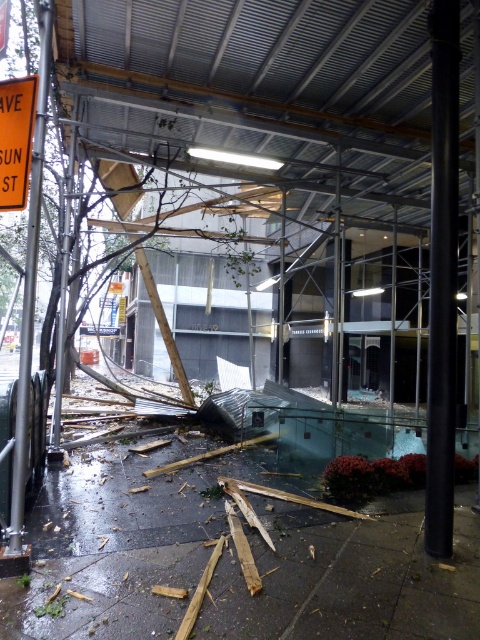
Between point (50, 616) and point (15, 515), which one is positioned behind?

The point (15, 515) is more distant.

Does wet concrete pavement at lower center appear under green metallic pole at left?

Indeed, wet concrete pavement at lower center is positioned under green metallic pole at left.

This screenshot has height=640, width=480. Find the location of `wet concrete pavement at lower center`. wet concrete pavement at lower center is located at coordinates (121, 540).

Does wet concrete pavement at lower center have a smaller size compared to orange reflective plastic sign at upper left?

Incorrect, wet concrete pavement at lower center is not smaller in size than orange reflective plastic sign at upper left.

Does wet concrete pavement at lower center appear on the right side of orange reflective plastic sign at upper left?

Yes, wet concrete pavement at lower center is to the right of orange reflective plastic sign at upper left.

Where is `wet concrete pavement at lower center`? Image resolution: width=480 pixels, height=640 pixels. wet concrete pavement at lower center is located at coordinates (121, 540).

The height and width of the screenshot is (640, 480). What are the coordinates of `wet concrete pavement at lower center` in the screenshot? It's located at (121, 540).

Is point (439, 396) behind point (1, 148)?

Yes, it is.

Is black metal pole at right positioned in front of orange reflective plastic sign at upper left?

That is False.

The width and height of the screenshot is (480, 640). In order to click on black metal pole at right in this screenshot , I will do `click(443, 276)`.